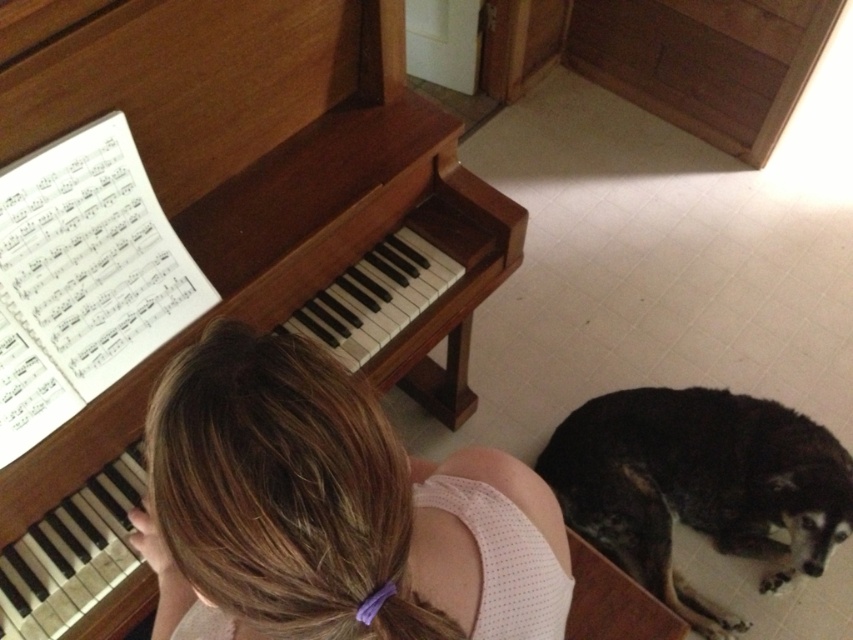
Is brown hair at upper center below black fur dog at lower right?

Incorrect, brown hair at upper center is not positioned below black fur dog at lower right.

Which is in front, point (172, 467) or point (741, 445)?

Point (172, 467) is in front.

Locate an element on the screen. This screenshot has height=640, width=853. brown hair at upper center is located at coordinates (320, 506).

Does wooden piano at left appear under black fur dog at lower right?

No.

Which of these two, wooden piano at left or black fur dog at lower right, stands taller?

wooden piano at left

Is point (281, 129) closer to viewer compared to point (668, 547)?

Yes, it is in front of point (668, 547).

Find the location of `wooden piano at left`. wooden piano at left is located at coordinates (254, 193).

Who is lower down, wooden piano at left or brown hair at upper center?

brown hair at upper center

Does wooden piano at left have a larger size compared to brown hair at upper center?

Yes, wooden piano at left is bigger than brown hair at upper center.

Which is in front, point (318, 6) or point (454, 548)?

Point (454, 548)

The width and height of the screenshot is (853, 640). I want to click on wooden piano at left, so click(254, 193).